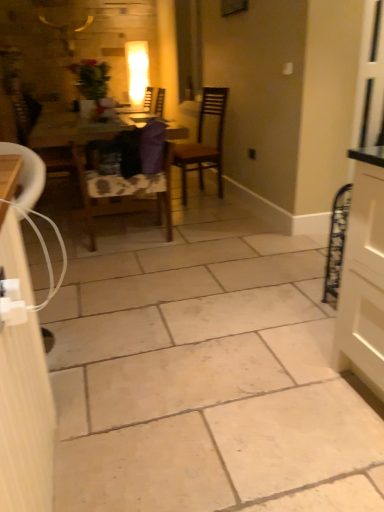
Identify the location of free point behind wooden chair at center, which is the 2th chair from left to right. (133, 221).